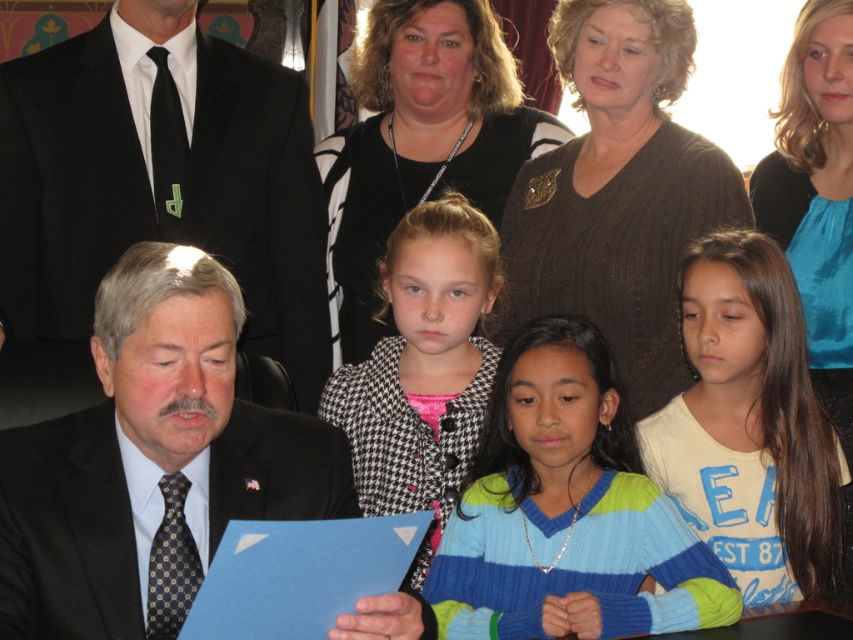
You are attending a formal event and need to locate two specific items in the scene. The black suit at left and the white cotton shirt at lower right. Which one is positioned lower in the image?

→ The black suit at left is located below the white cotton shirt at lower right, so the black suit at left is positioned lower in the image.

You are standing in the room and want to move from the point at coordinates point at (44, 522) to the point at (795, 321). Which direction should you move to reach your destination?

To move from point at (44, 522) to point at (795, 321), you should move towards the upper left direction since point at (44, 522) is in front of point at (795, 321).

In the scene shown: You are organizing a photo shoot and need to ensure that the black suit at left and the houndstooth coat at center are positioned at least 30 inches apart for proper lighting. Based on the current setup, is this requirement met?

The black suit at left and houndstooth coat at center are currently 25.65 inches apart, which is less than the required 30 inches. Therefore, the requirement is not met and they need to be moved further apart.